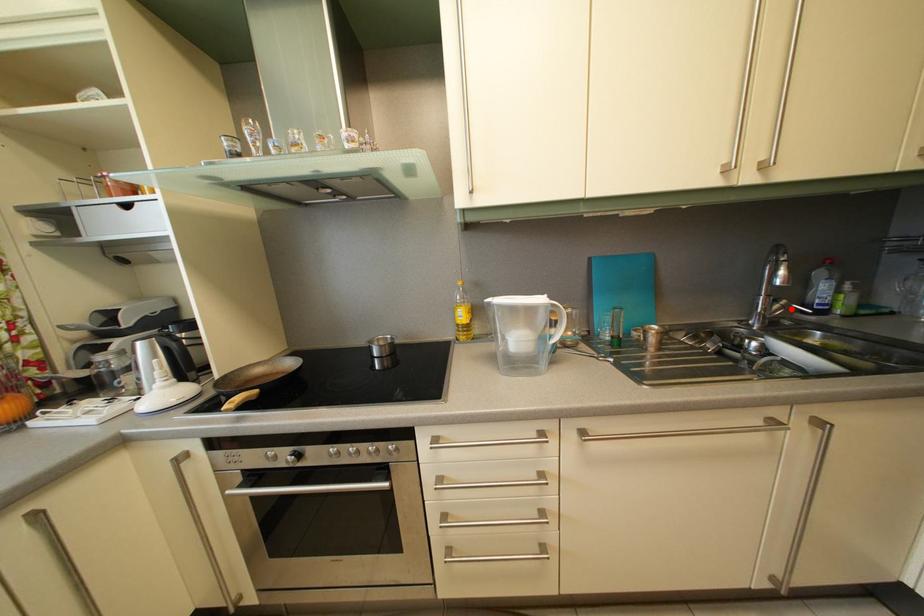
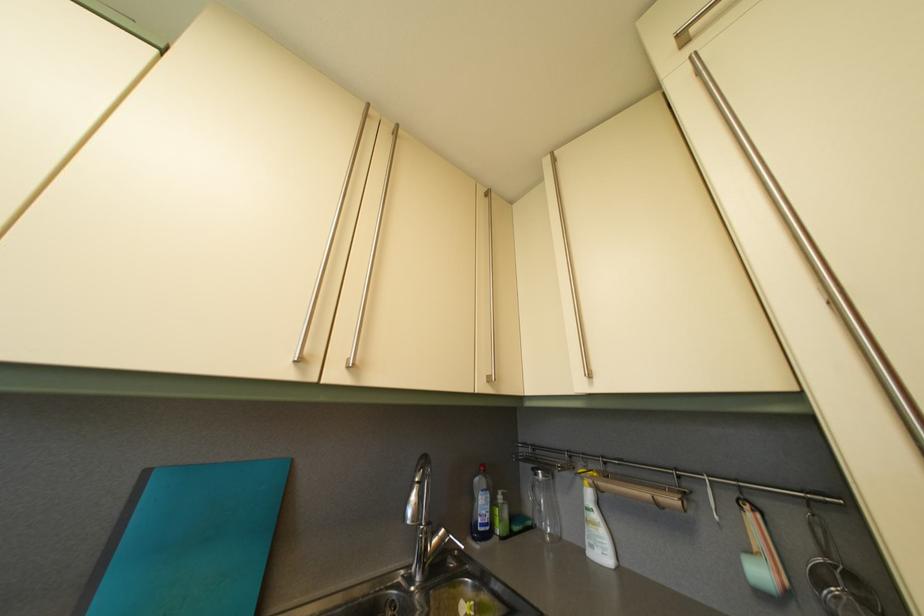
In the second image, find the point that corresponds to the highlighted location in the first image.

(451, 539)